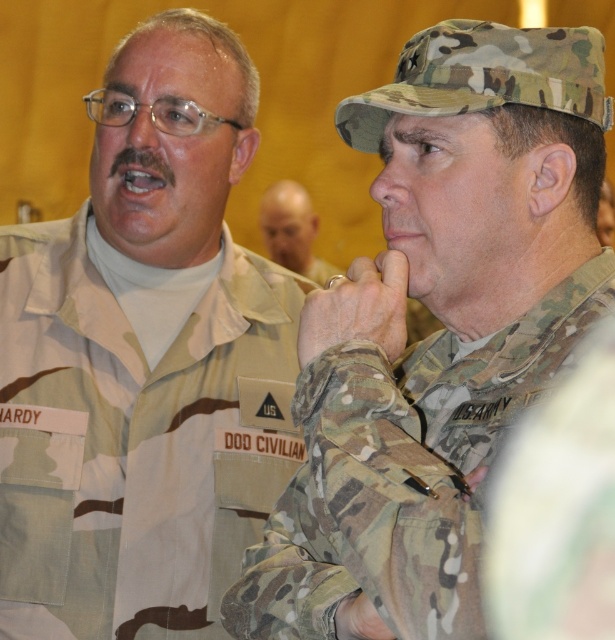
Question: Is camouflage uniform at left in front of matte camouflage glove at center?

Choices:
 (A) yes
 (B) no

Answer: (B)

Question: Which point is farther to the camera?

Choices:
 (A) camouflage uniform at left
 (B) smooth bald head at center
 (C) camouflage fabric uniform at center
 (D) camouflage fabric hand at center

Answer: (B)

Question: Can you confirm if camouflage fabric uniform at center is smaller than camouflage fabric hand at center?

Choices:
 (A) yes
 (B) no

Answer: (B)

Question: Which object appears farthest from the camera in this image?

Choices:
 (A) smooth bald head at center
 (B) camouflage uniform at left
 (C) matte camouflage glove at center
 (D) camouflage fabric hand at center

Answer: (A)

Question: Considering the relative positions of camouflage fabric uniform at center and smooth bald head at center in the image provided, where is camouflage fabric uniform at center located with respect to smooth bald head at center?

Choices:
 (A) below
 (B) above

Answer: (A)

Question: Which point is closer to the camera?

Choices:
 (A) (454, 404)
 (B) (322, 291)
 (C) (271, 212)

Answer: (B)